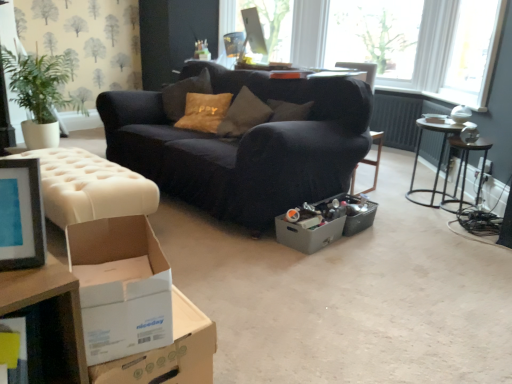
Describe the element at coordinates (466, 171) in the screenshot. I see `metallic dark brown side table at right` at that location.

You are a GUI agent. You are given a task and a screenshot of the screen. Output one action in this format:
    pyautogui.click(x=<x>, y=<y>)
    Task: Click on the white glossy table at upper center, which ranks as the 2th table in right-to-left order
    The height and width of the screenshot is (384, 512).
    Given the screenshot: What is the action you would take?
    pyautogui.click(x=338, y=74)

Identify the location of white cardboard box at lower left, which is the first cardboard box in left-to-right order. The height and width of the screenshot is (384, 512). (169, 353).

Locate an element on the screen. matte black picture frame at left is located at coordinates (22, 214).

Is velvet dark blue couch at center far away from metallic gray storage box at center?

No, there isn't a large distance between velvet dark blue couch at center and metallic gray storage box at center.

Between velvet dark blue couch at center and metallic gray storage box at center, which one is positioned behind?

metallic gray storage box at center.

Which of these two, velvet dark blue couch at center or metallic gray storage box at center, is bigger?

Bigger between the two is velvet dark blue couch at center.

Is metallic gray storage box at center smaller than transparent glass window at upper right?

Correct, metallic gray storage box at center occupies less space than transparent glass window at upper right.

From the image's perspective, between metallic gray storage box at center and transparent glass window at upper right, who is located below?

metallic gray storage box at center.

Identify the location of window screen above the metallic gray storage box at center (from a real-world perspective). (375, 34).

Would you say transparent glass window at upper right is part of metallic gray storage box at center's contents?

No, metallic gray storage box at center does not contain transparent glass window at upper right.

How far apart are metallic dark brown side table at right and velvet dark blue couch at center?

metallic dark brown side table at right and velvet dark blue couch at center are 1.47 meters apart.

Does point (461, 192) come farther from viewer compared to point (127, 122)?

Yes, point (461, 192) is farther from viewer.

Is metallic dark brown side table at right to the left or to the right of velvet dark blue couch at center in the image?

In the image, metallic dark brown side table at right appears on the right side of velvet dark blue couch at center.

Find the location of `side table that is on the right side of velvet dark blue couch at center`. side table that is on the right side of velvet dark blue couch at center is located at coordinates (466, 171).

Between matte black picture frame at left and metallic gray storage box at center, which one appears on the left side from the viewer's perspective?

Positioned to the left is matte black picture frame at left.

Looking at the image, does matte black picture frame at left seem bigger or smaller compared to metallic gray storage box at center?

matte black picture frame at left is smaller than metallic gray storage box at center.

Which object is further away from the camera, matte black picture frame at left or metallic gray storage box at center?

metallic gray storage box at center is further from the camera.

From a real-world perspective, is matte black picture frame at left positioned above or below metallic gray storage box at center?

matte black picture frame at left is situated higher than metallic gray storage box at center in the real world.

Could you tell me if white cardboard box at lower left, the second cardboard box in the back-to-front sequence, is turned towards metallic gray storage box at center?

Yes, white cardboard box at lower left, the second cardboard box in the back-to-front sequence, is aimed at metallic gray storage box at center.

What's the angular difference between white cardboard box at lower left, positioned as the 2th cardboard box in front-to-back order, and metallic gray storage box at center's facing directions?

77.6 degrees.

Can metallic gray storage box at center be found inside white cardboard box at lower left, the second cardboard box in the back-to-front sequence?

No, white cardboard box at lower left, the second cardboard box in the back-to-front sequence, does not contain metallic gray storage box at center.

From the picture: Is the depth of white cardboard box at lower left, which is the first cardboard box in left-to-right order, less than that of metallic gray storage box at center?

Yes, it is.

In the image, is velvet dark blue couch at center positioned in front of or behind matte black picture frame at left?

Clearly, velvet dark blue couch at center is behind matte black picture frame at left.

From a real-world perspective, is velvet dark blue couch at center over matte black picture frame at left?

Actually, velvet dark blue couch at center is physically below matte black picture frame at left in the real world.

In terms of size, does velvet dark blue couch at center appear bigger or smaller than matte black picture frame at left?

In the image, velvet dark blue couch at center appears to be larger than matte black picture frame at left.

Is velvet dark blue couch at center thinner than matte black picture frame at left?

No, velvet dark blue couch at center is not thinner than matte black picture frame at left.

Can you tell me how much transparent glass window at upper right and white cardboard box at lower left, the second cardboard box in the back-to-front sequence, differ in facing direction?

There is a 169-degree angle between the facing directions of transparent glass window at upper right and white cardboard box at lower left, the second cardboard box in the back-to-front sequence.

From a real-world perspective, is transparent glass window at upper right beneath white cardboard box at lower left, which is the first cardboard box in left-to-right order?

No.

From the image's perspective, is transparent glass window at upper right above white cardboard box at lower left, which is the first cardboard box in left-to-right order?

Yes, from the image's perspective, transparent glass window at upper right is above white cardboard box at lower left, which is the first cardboard box in left-to-right order.

Considering the positions of point (369, 8) and point (130, 377), is point (369, 8) closer or farther from the camera than point (130, 377)?

Point (369, 8) is positioned farther from the camera compared to point (130, 377).

Where is `studio couch above the metallic gray storage box at center (from a real-world perspective)`? The height and width of the screenshot is (384, 512). studio couch above the metallic gray storage box at center (from a real-world perspective) is located at coordinates [245, 145].

Where is `storage box below the transparent glass window at upper right (from the image's perspective)`? The height and width of the screenshot is (384, 512). storage box below the transparent glass window at upper right (from the image's perspective) is located at coordinates (360, 220).

Based on their spatial positions, is transparent glass window at upper right or white cardboard box at lower left, which is the second cardboard box in right-to-left order, closer to metallic silver table at right, arranged as the 1th table when ordered from the bottom?

transparent glass window at upper right lies closer to metallic silver table at right, arranged as the 1th table when ordered from the bottom, than the other object.

In the scene shown: From the image, which object appears to be farther from metallic dark brown side table at right, white cardboard box at lower left, the first cardboard box positioned from the front, or metallic gray storage box at center?

white cardboard box at lower left, the first cardboard box positioned from the front, is positioned further to the anchor metallic dark brown side table at right.

When comparing their distances from metallic silver table at right, acting as the 1th table starting from the right, does metallic dark brown side table at right or white cardboard box at lower left, the second cardboard box from the left, seem further?

white cardboard box at lower left, the second cardboard box from the left, lies further to metallic silver table at right, acting as the 1th table starting from the right, than the other object.

From the image, which object appears to be farther from metallic silver table at right, which is the second table from left to right, white cardboard box at lower left, the second cardboard box from the left, or metallic gray storage box at center?

white cardboard box at lower left, the second cardboard box from the left, is further to metallic silver table at right, which is the second table from left to right.

From the image, which object appears to be nearer to metallic dark brown side table at right, white cardboard box at lower left, the second cardboard box in the back-to-front sequence, or white glossy table at upper center, which appears as the 2th table when ordered from the bottom?

white glossy table at upper center, which appears as the 2th table when ordered from the bottom, is closer to metallic dark brown side table at right.

Based on their spatial positions, is velvet dark blue couch at center or metallic silver table at right, acting as the 1th table starting from the right, further from metallic gray storage box at center?

The object further to metallic gray storage box at center is velvet dark blue couch at center.

Estimate the real-world distances between objects in this image. Which object is further from transparent glass window at upper right, white tufted ottoman at left or velvet dark blue couch at center?

white tufted ottoman at left.

Considering their positions, is metallic gray storage box at center positioned closer to white glossy table at upper center, which appears as the 2th table when ordered from the bottom, than white cardboard box at lower left, the second cardboard box in the back-to-front sequence?

Among the two, metallic gray storage box at center is located nearer to white glossy table at upper center, which appears as the 2th table when ordered from the bottom.

Where is `storage box located between white cardboard box at lower left, which is the second cardboard box in right-to-left order, and transparent glass window at upper right in the depth direction`? The image size is (512, 384). storage box located between white cardboard box at lower left, which is the second cardboard box in right-to-left order, and transparent glass window at upper right in the depth direction is located at coordinates (360, 220).

Locate an element on the screen. This screenshot has width=512, height=384. studio couch between white cardboard box at lower left, which is the first cardboard box in left-to-right order, and transparent glass window at upper right, along the z-axis is located at coordinates (245, 145).

Find the location of a particular element. The image size is (512, 384). storage box between gray cardboard box at center, marked as the 3th cardboard box in a left-to-right arrangement, and metallic silver table at right, acting as the 1th table starting from the right, from left to right is located at coordinates (360, 220).

Identify the location of window screen between white tufted ottoman at left and metallic dark brown side table at right from left to right. The width and height of the screenshot is (512, 384). (375, 34).